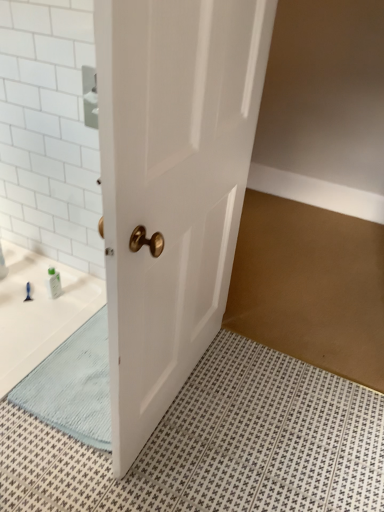
Image resolution: width=384 pixels, height=512 pixels. Describe the element at coordinates (39, 311) in the screenshot. I see `white matte bath at lower left` at that location.

At what (x,y) coordinates should I click in order to perform the action: click on white matte bath at lower left. Please return your answer as a coordinate pair (x, y). Looking at the image, I should click on (39, 311).

The image size is (384, 512). Identify the location of white matte bath at lower left. (39, 311).